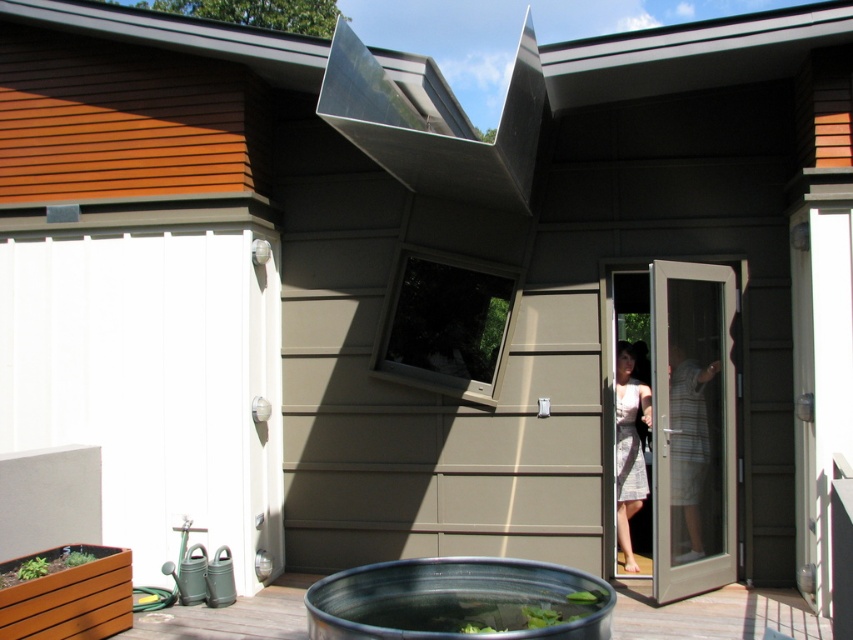
Consider the image. Who is more distant from viewer, (669, 332) or (459, 584)?

The point (669, 332) is behind.

Which of these two, clear glass screen door at center or metallic silver tub at lower center, stands shorter?

Standing shorter between the two is metallic silver tub at lower center.

Is point (664, 429) closer to viewer compared to point (314, 595)?

No, (664, 429) is further to viewer.

You are a GUI agent. You are given a task and a screenshot of the screen. Output one action in this format:
    pyautogui.click(x=<x>, y=<y>)
    Task: Click on the clear glass screen door at center
    
    Given the screenshot: What is the action you would take?
    pyautogui.click(x=692, y=428)

Between smooth wooden deck at lower left and striped cotton shirt at door, which one has less height?

Standing shorter between the two is smooth wooden deck at lower left.

Describe the element at coordinates (714, 614) in the screenshot. The width and height of the screenshot is (853, 640). I see `smooth wooden deck at lower left` at that location.

I want to click on smooth wooden deck at lower left, so click(714, 614).

Does point (518, 637) lie behind point (711, 596)?

No, it is in front of (711, 596).

Who is positioned more to the left, metallic silver tub at lower center or smooth wooden deck at lower left?

metallic silver tub at lower center is more to the left.

Is point (538, 628) positioned in front of point (241, 630)?

Yes.

Where is `metallic silver tub at lower center`? This screenshot has height=640, width=853. metallic silver tub at lower center is located at coordinates tap(457, 600).